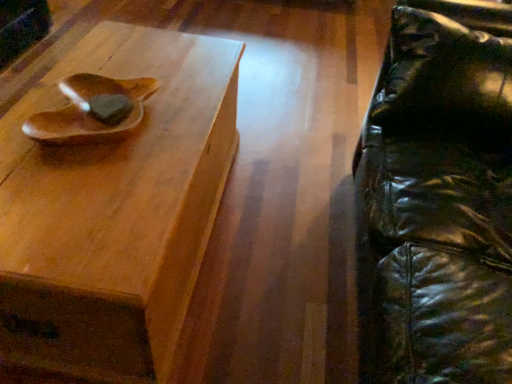
Question: Is black leather swivel chair at right wider or thinner than wooden bowl at upper left?

Choices:
 (A) wide
 (B) thin

Answer: (A)

Question: Considering the relative positions of black leather swivel chair at right and wooden bowl at upper left in the image provided, is black leather swivel chair at right to the left or to the right of wooden bowl at upper left?

Choices:
 (A) left
 (B) right

Answer: (B)

Question: Which object is positioned closest to the wooden bowl at upper left?

Choices:
 (A) black leather swivel chair at right
 (B) wooden tray at upper left

Answer: (B)

Question: Which is farther from the wooden bowl at upper left?

Choices:
 (A) wooden tray at upper left
 (B) black leather swivel chair at right

Answer: (B)